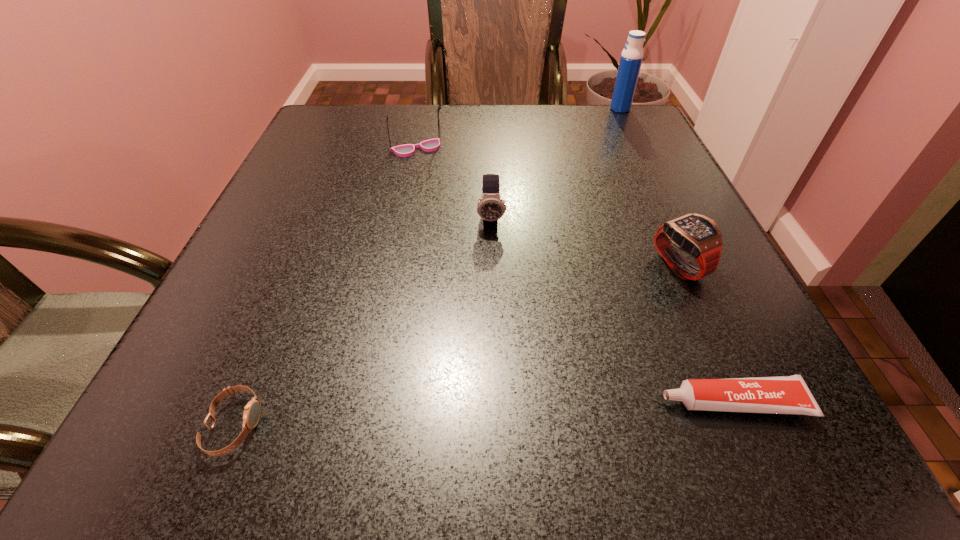
This screenshot has height=540, width=960. What are the coordinates of `free spot between the leftmost watch and the spectacles` in the screenshot? It's located at (326, 287).

The image size is (960, 540). Identify the location of free space between the third farthest object and the water bottle. (556, 164).

Locate an element on the screen. This screenshot has height=540, width=960. free space between the water bottle and the second farthest object is located at coordinates (518, 129).

The width and height of the screenshot is (960, 540). Find the location of `free point between the rightmost watch and the spectacles`. free point between the rightmost watch and the spectacles is located at coordinates (548, 207).

Identify which object is the third closest to the second farthest watch. Please provide its 2D coordinates. Your answer should be formatted as a tuple, i.e. [(x, y)], where the tuple contains the x and y coordinates of a point satisfying the conditions above.

[(430, 145)]

Identify which object is the fifth closest to the nearest watch. Please provide its 2D coordinates. Your answer should be formatted as a tuple, i.e. [(x, y)], where the tuple contains the x and y coordinates of a point satisfying the conditions above.

[(631, 58)]

Identify which watch is the second nearest to the water bottle. Please provide its 2D coordinates. Your answer should be formatted as a tuple, i.e. [(x, y)], where the tuple contains the x and y coordinates of a point satisfying the conditions above.

[(697, 235)]

Identify which watch is located as the second nearest to the leftmost object. Please provide its 2D coordinates. Your answer should be formatted as a tuple, i.e. [(x, y)], where the tuple contains the x and y coordinates of a point satisfying the conditions above.

[(697, 235)]

Identify the location of free space that satisfies the following two spatial constraints: 1. on the front side of the farthest object; 2. at the nozzle of the toothpaste. This screenshot has width=960, height=540. (762, 402).

Find the location of `free spot that satisfies the following two spatial constraints: 1. on the front side of the water bottle; 2. on the face of the shortest watch`. free spot that satisfies the following two spatial constraints: 1. on the front side of the water bottle; 2. on the face of the shortest watch is located at coordinates [x=774, y=426].